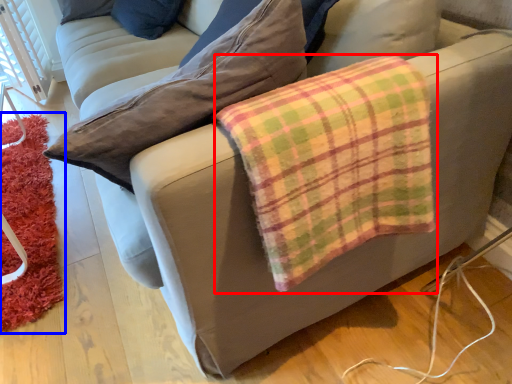
Question: Which object is further to the camera taking this photo, flannel (highlighted by a red box) or mat (highlighted by a blue box)?

Choices:
 (A) flannel
 (B) mat

Answer: (B)